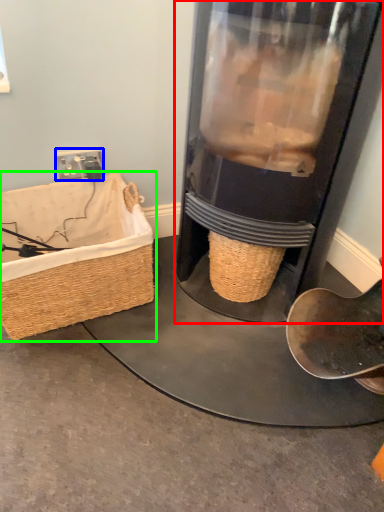
Question: Which is nearer to the appliance (highlighted by a red box)? plug (highlighted by a blue box) or picnic basket (highlighted by a green box).

Choices:
 (A) plug
 (B) picnic basket

Answer: (B)